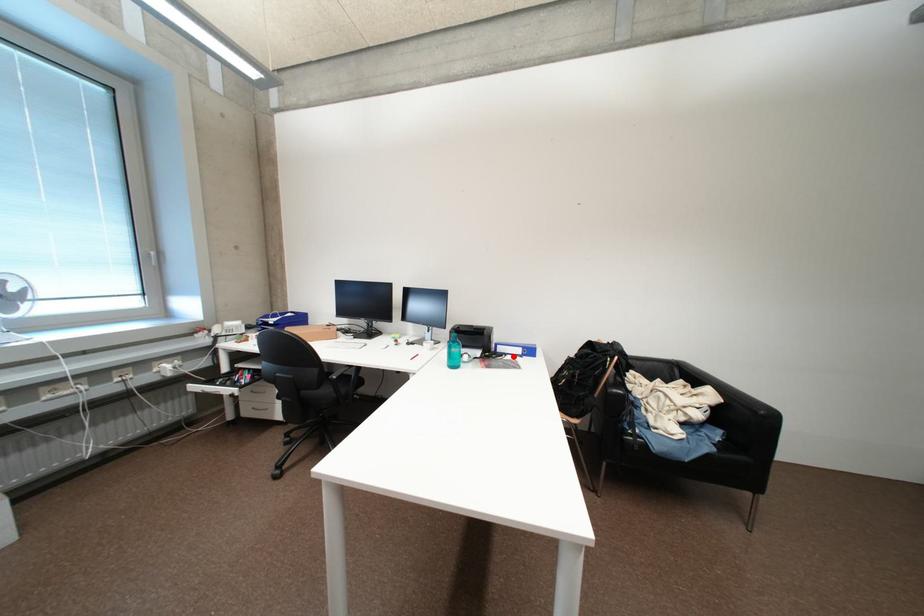
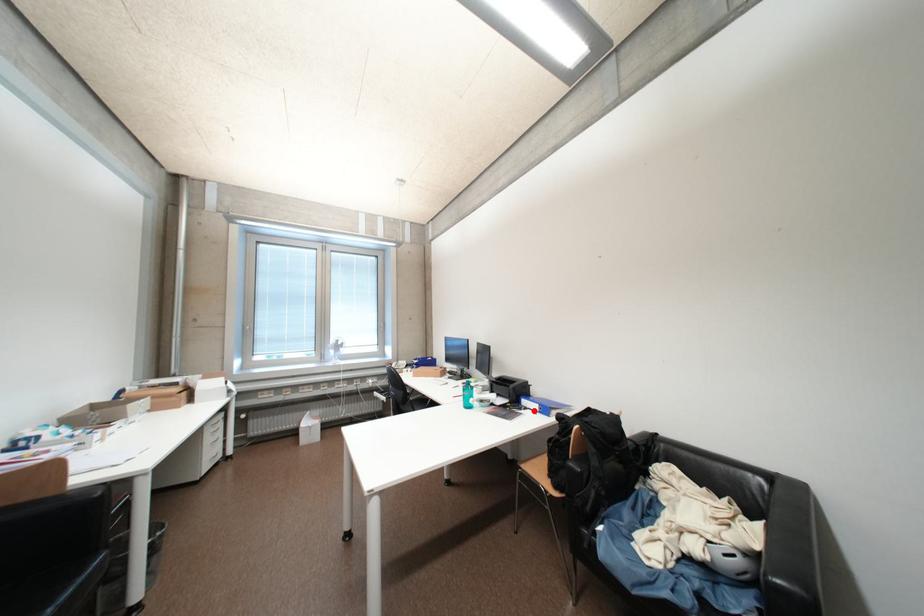
I am providing you with two images of the same scene from different viewpoints. A red point is marked on the first image and another point is marked on the second image. Does the point marked in image1 correspond to the same location as the one in image2?

Yes